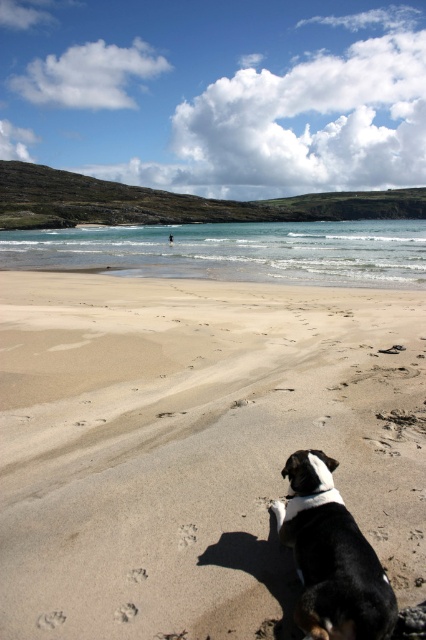
You are planning to build a small sandcastle on the sandy beach at lower center and the black and white fur at lower right. Which location would be more suitable for building the sandcastle?

The sandy beach at lower center is more suitable for building the sandcastle because it is bigger than the black and white fur at lower right, providing more space for construction.